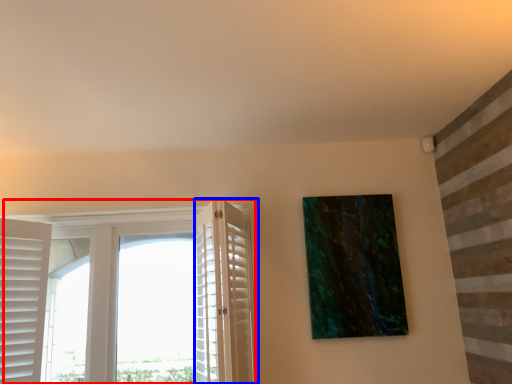
Question: Which point is further to the camera, window (highlighted by a red box) or screen door (highlighted by a blue box)?

Choices:
 (A) window
 (B) screen door

Answer: (A)